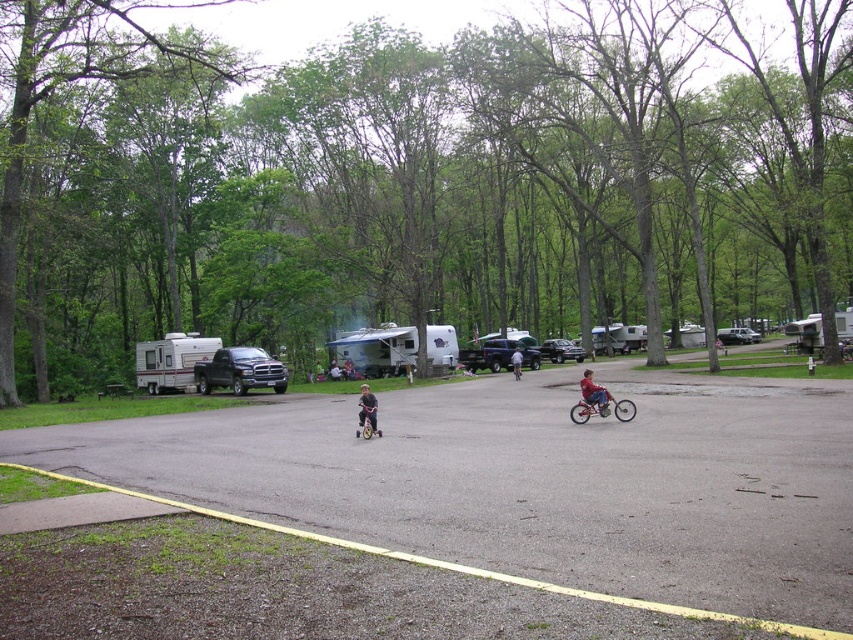
Question: Which of these objects is positioned farthest from the matte blue bicycle at center?

Choices:
 (A) metallic silver suv at center
 (B) white plastic camper at right
 (C) dark brown fur dog at center
 (D) white plastic camper at center

Answer: (D)

Question: Can you confirm if gray asphalt parking lot at center is positioned to the left of white plastic camper at right?

Choices:
 (A) no
 (B) yes

Answer: (B)

Question: Based on their relative distances, which object is farther from the silver metallic van at center?

Choices:
 (A) dark brown fur dog at center
 (B) white plastic camper at right
 (C) light blue denim shorts at center
 (D) silver metallic camper at left

Answer: (A)

Question: Estimate the real-world distances between objects in this image. Which object is closer to the matte blue bicycle at center?

Choices:
 (A) white textured camper at center
 (B) silver metallic van at center
 (C) light blue denim shorts at center

Answer: (C)

Question: Is white plastic camper at center thinner than dark brown fur dog at center?

Choices:
 (A) yes
 (B) no

Answer: (B)

Question: Is gray asphalt parking lot at center to the right of white textured camper at center from the viewer's perspective?

Choices:
 (A) yes
 (B) no

Answer: (A)